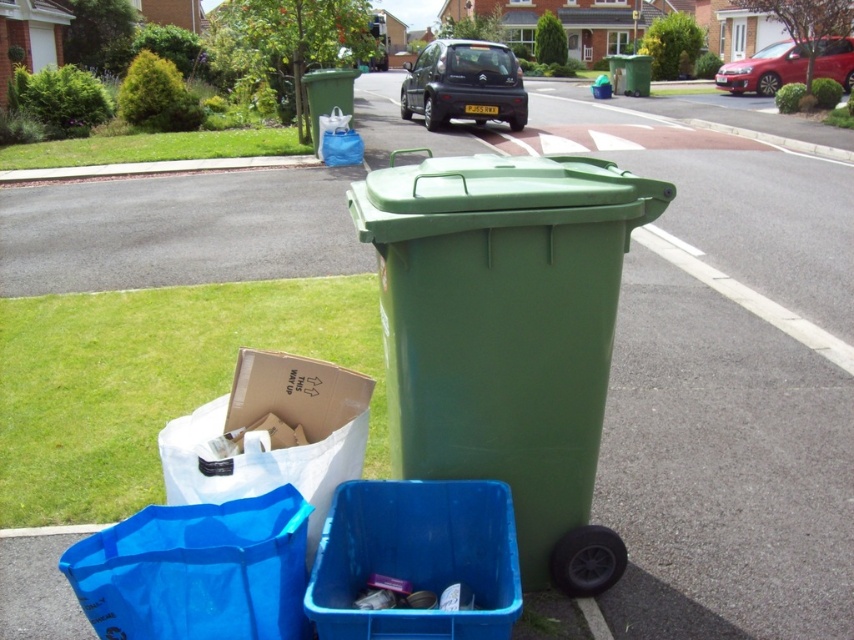
You are a waste collector driving a truck and need to pick up the green plastic recycling bin at center and the blue plastic bag at lower left. According to the scene, which object should you collect first based on their positions?

The green plastic recycling bin at center is above the blue plastic bag at lower left, so you should collect the blue plastic bag at lower left first as it is positioned lower and closer to the ground.

You are standing at the origin point of the image coordinate system. You want to walk to the blue plastic recycling bin at lower center. What are the coordinates you need to move towards?

The coordinates you need to move towards are 0.873 in the x direction and 0.488 in the y direction.